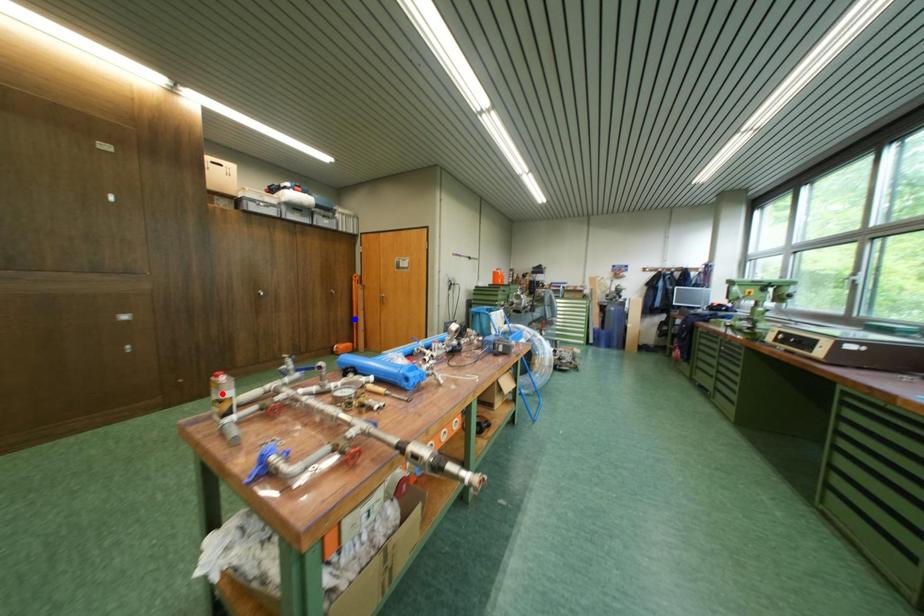
Question: Two points are marked on the image. Which point is closer to the camera?

Choices:
 (A) Blue point is closer.
 (B) Red point is closer.

Answer: (B)